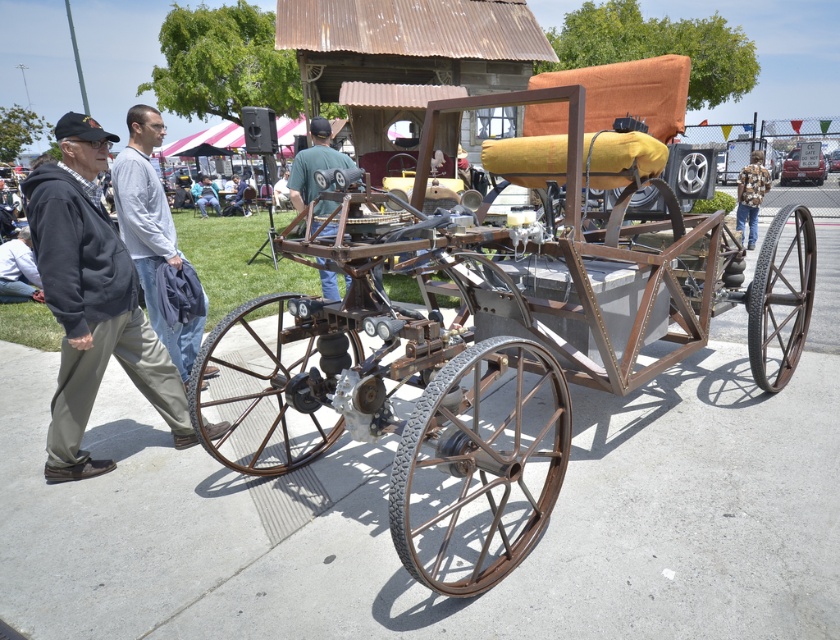
Question: Considering the real-world distances, which object is farthest from the floral-patterned shirt at center?

Choices:
 (A) green matte shirt at center
 (B) rusty metal horse cart at center

Answer: (A)

Question: Which object is positioned closest to the floral-patterned shirt at center?

Choices:
 (A) light gray sweater at left
 (B) light blue jeans at lower left
 (C) rusty metal horse cart at center

Answer: (C)

Question: Can you confirm if dark gray hoodie at left is bigger than light gray sweater at left?

Choices:
 (A) yes
 (B) no

Answer: (A)

Question: Does rusty metal horse cart at center lie behind light blue jeans at lower left?

Choices:
 (A) no
 (B) yes

Answer: (A)

Question: From the image, what is the correct spatial relationship of dark gray hoodie at left in relation to light gray sweater at left?

Choices:
 (A) left
 (B) right

Answer: (B)

Question: Based on their relative distances, which object is farther from the green matte shirt at center?

Choices:
 (A) light blue jeans at lower left
 (B) floral-patterned shirt at center

Answer: (B)